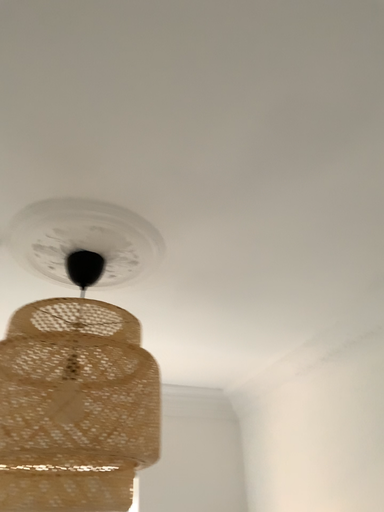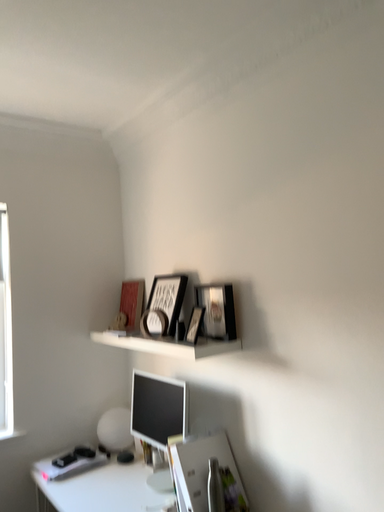
Question: How did the camera likely rotate when shooting the video?

Choices:
 (A) rotated downward
 (B) rotated upward

Answer: (A)